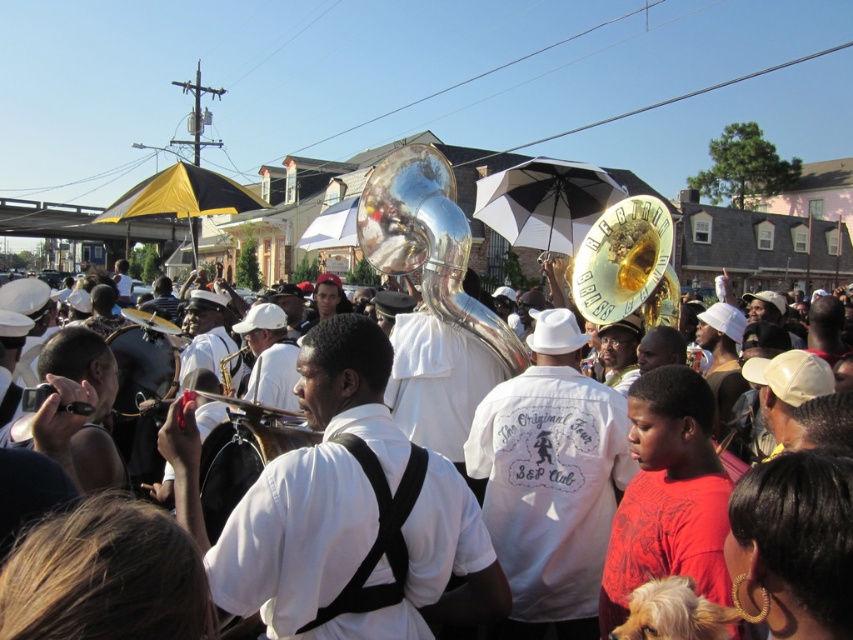
Find the location of `silver metallic tuba at center`. silver metallic tuba at center is located at coordinates click(x=428, y=243).

Can you confirm if silver metallic tuba at center is positioned above gold shiny tuba at center?

Incorrect, silver metallic tuba at center is not positioned above gold shiny tuba at center.

Where is `silver metallic tuba at center`? The height and width of the screenshot is (640, 853). silver metallic tuba at center is located at coordinates (428, 243).

Identify the location of silver metallic tuba at center. The image size is (853, 640). (428, 243).

Does gold shiny tuba at center come behind black matte camera at center?

Yes.

Measure the distance between point (598, 273) and camera.

Point (598, 273) is 39.51 meters away from camera.

You are a GUI agent. You are given a task and a screenshot of the screen. Output one action in this format:
    pyautogui.click(x=<x>, y=<y>)
    Task: Click on the gold shiny tuba at center
    The width and height of the screenshot is (853, 640).
    Given the screenshot: What is the action you would take?
    pyautogui.click(x=627, y=266)

Is white matte shirt at center behind gold shiny tuba at center?

No, white matte shirt at center is in front of gold shiny tuba at center.

The width and height of the screenshot is (853, 640). In order to click on white matte shirt at center in this screenshot , I will do `click(550, 481)`.